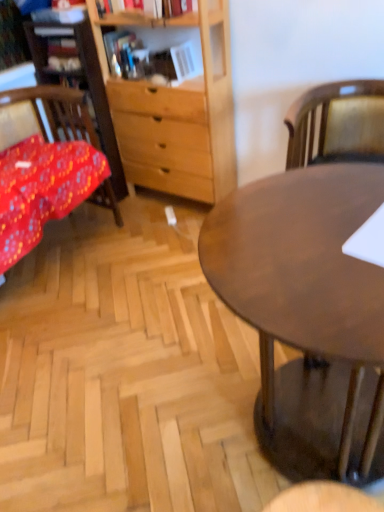
Identify the location of wooden desk at center. Image resolution: width=384 pixels, height=512 pixels. (308, 314).

What is the approximate width of wooden desk at center?

29.20 inches.

In order to face wooden desk at center, should I rotate leftwards or rightwards?

Rotate right and turn 15.983 degrees.

Measure the distance between wooden desk at center and camera.

wooden desk at center is 28.28 inches from camera.

What do you see at coordinates (308, 314) in the screenshot? I see `wooden desk at center` at bounding box center [308, 314].

Find the location of a particular element. This screenshot has width=384, height=512. wooden desk at center is located at coordinates (308, 314).